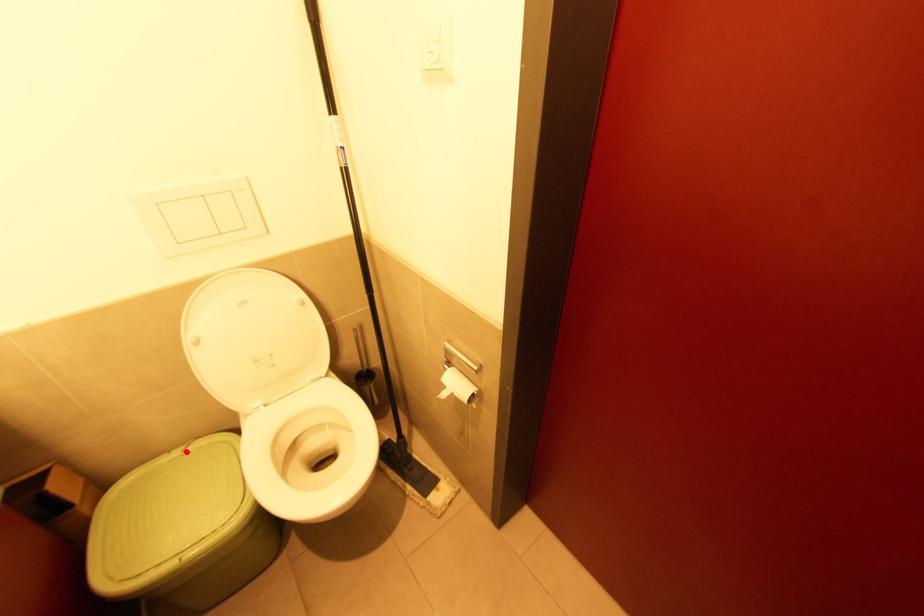
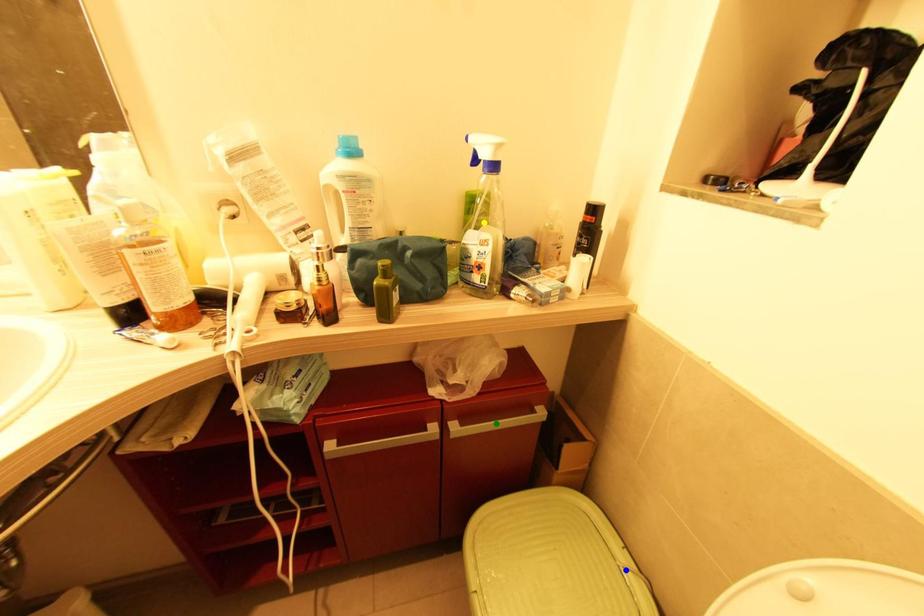
Question: I am providing you with two images of the same scene from different viewpoints. A red point is marked on the first image. You are given multiple points on the second image. Which spot in image 2 lines up with the point in image 1?

Choices:
 (A) yellow point
 (B) blue point
 (C) green point

Answer: (B)